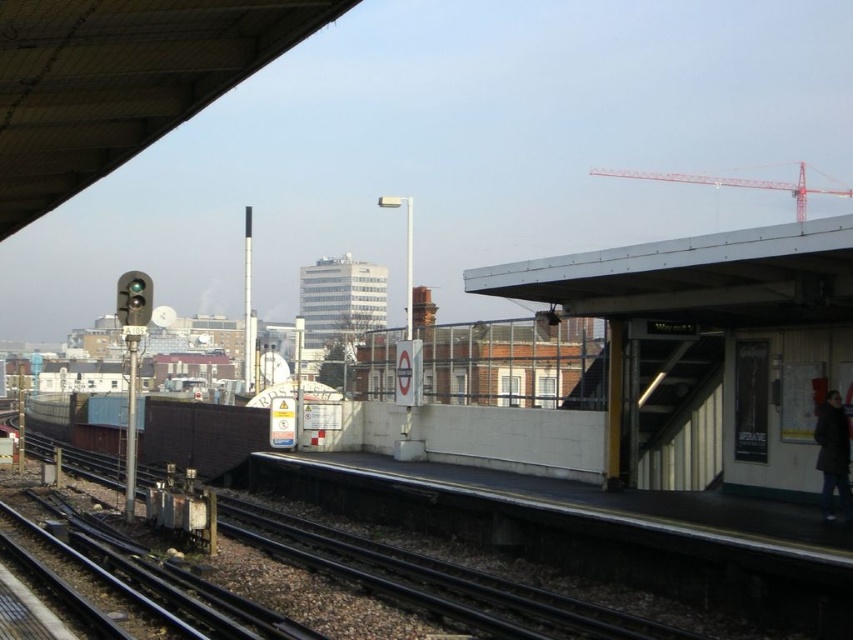
Question: Considering the relative positions of black metal track at lower left and dark gray wool coat at right in the image provided, where is black metal track at lower left located with respect to dark gray wool coat at right?

Choices:
 (A) below
 (B) above

Answer: (A)

Question: Does black metal track at lower left lie in front of dark gray wool coat at right?

Choices:
 (A) no
 (B) yes

Answer: (B)

Question: Which point appears farthest from the camera in this image?

Choices:
 (A) (820, 410)
 (B) (405, 573)

Answer: (B)

Question: Does black metal track at lower left have a smaller size compared to dark gray wool coat at right?

Choices:
 (A) no
 (B) yes

Answer: (A)

Question: Among these points, which one is nearest to the camera?

Choices:
 (A) (282, 536)
 (B) (840, 500)

Answer: (B)